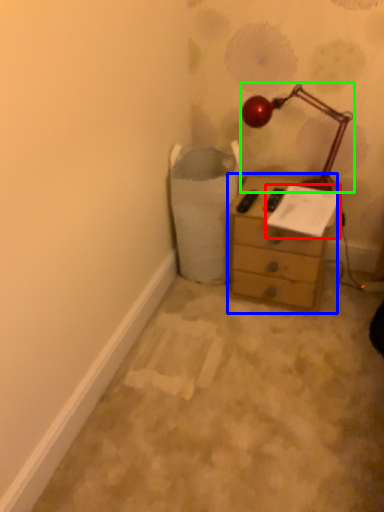
Question: Estimate the real-world distances between objects in this image. Which object is farther from paper (highlighted by a red box), chest of drawers (highlighted by a blue box) or lamp (highlighted by a green box)?

Choices:
 (A) chest of drawers
 (B) lamp

Answer: (B)